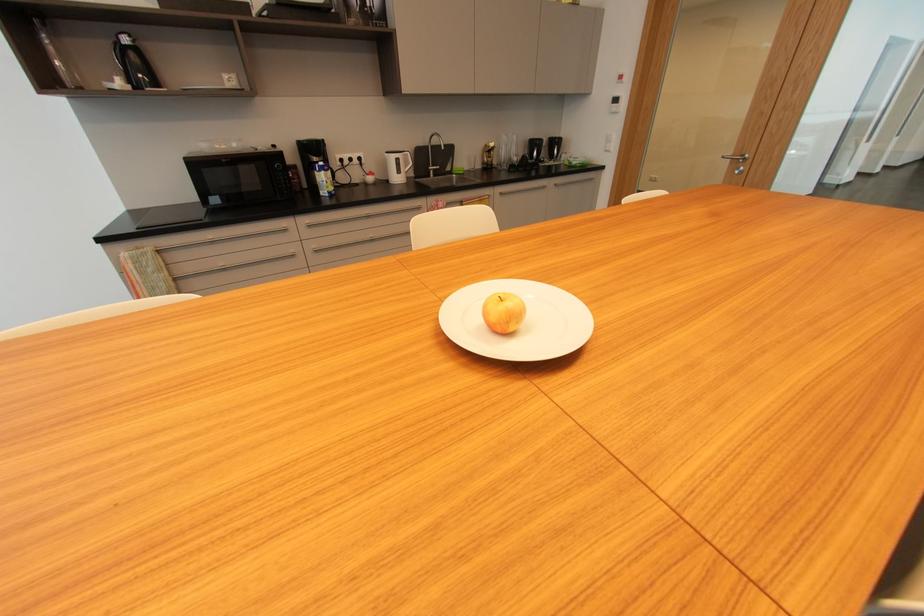
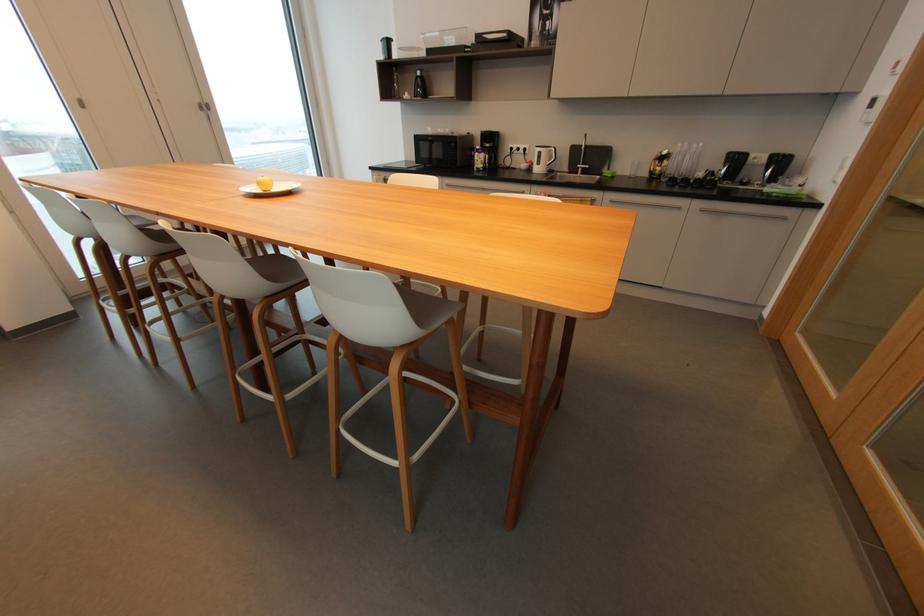
In the second image, find the point that corresponds to [444,147] in the first image.

(585, 147)